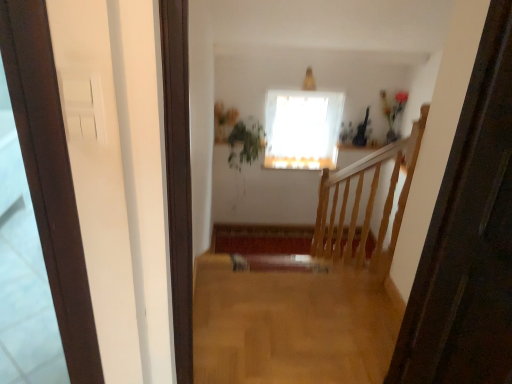
You are a GUI agent. You are given a task and a screenshot of the screen. Output one action in this format:
    pyautogui.click(x=<x>, y=<y>)
    Task: Click on the vacant point above white sheer curtain at upper center (from a real-world perspective)
    
    Given the screenshot: What is the action you would take?
    pyautogui.click(x=300, y=96)